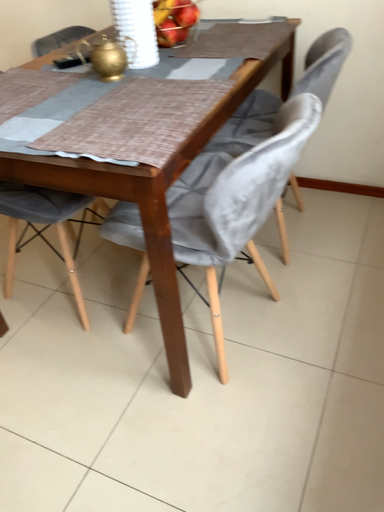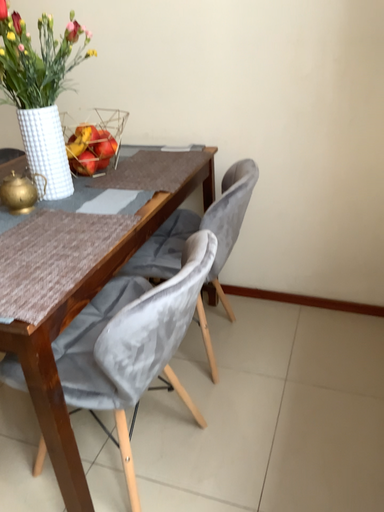
Question: Which way did the camera rotate in the video?

Choices:
 (A) rotated downward
 (B) rotated upward

Answer: (B)